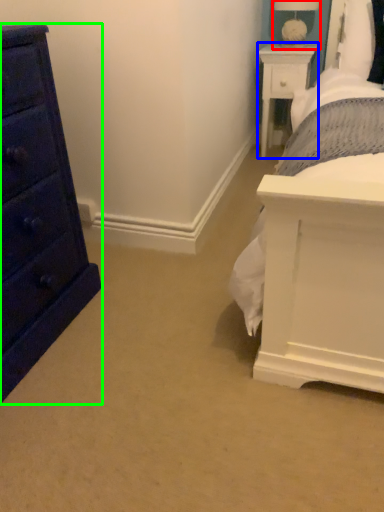
Question: Estimate the real-world distances between objects in this image. Which object is farther from table lamp (highlighted by a red box), nightstand (highlighted by a blue box) or chest of drawers (highlighted by a green box)?

Choices:
 (A) nightstand
 (B) chest of drawers

Answer: (B)